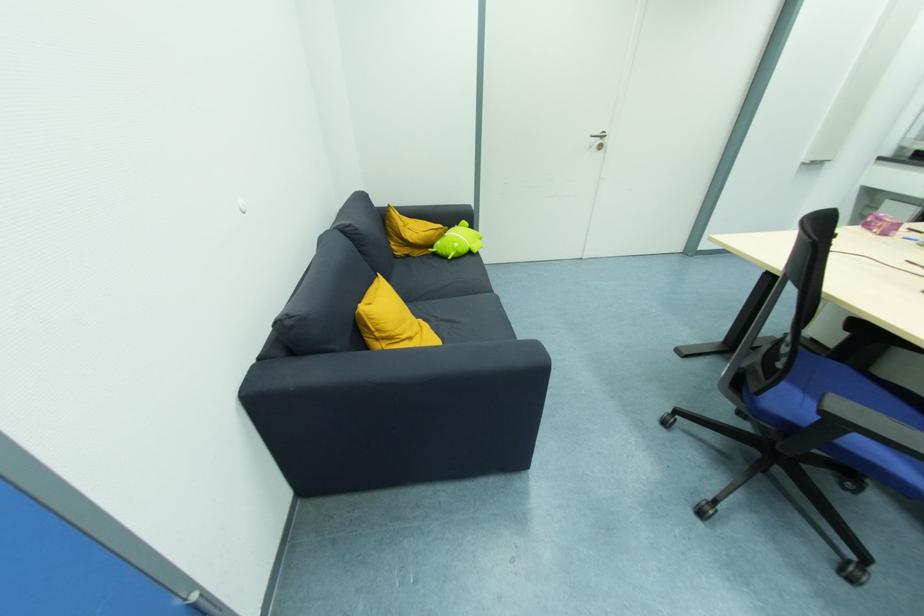
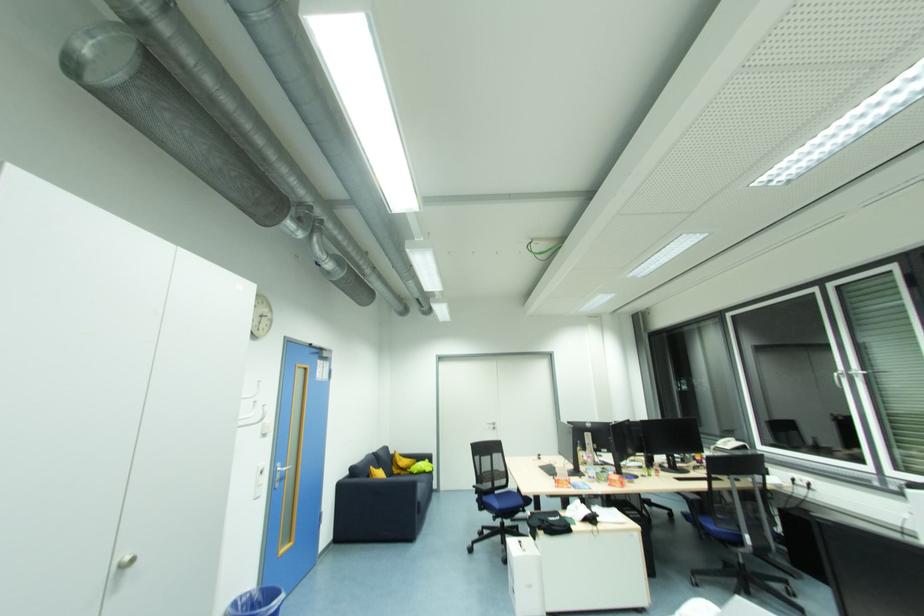
Find the pixel in the second image that matches (x=468, y=224) in the first image.

(430, 461)